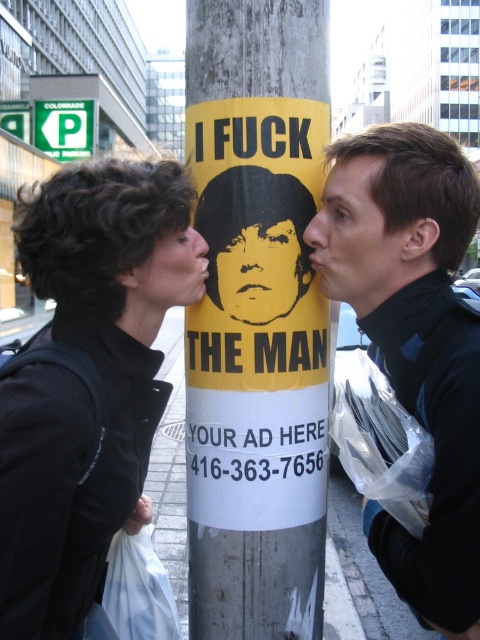
Question: Is yellow paper sign at center wider than black matte jacket at right?

Choices:
 (A) no
 (B) yes

Answer: (B)

Question: Which point appears farthest from the camera in this image?

Choices:
 (A) (348, 188)
 (B) (372, 536)

Answer: (B)

Question: Does black matte jacket at left have a smaller size compared to matte black face at center?

Choices:
 (A) yes
 (B) no

Answer: (B)

Question: Which object is closer to the camera taking this photo?

Choices:
 (A) smooth skin face at center
 (B) yellow matte poster at center

Answer: (A)

Question: Considering the real-world distances, which object is closest to the black matte jacket at right?

Choices:
 (A) black matte jacket at left
 (B) smooth skin face at center

Answer: (B)

Question: Observing the image, what is the correct spatial positioning of black matte jacket at left in reference to matte black face at center?

Choices:
 (A) right
 (B) left

Answer: (B)